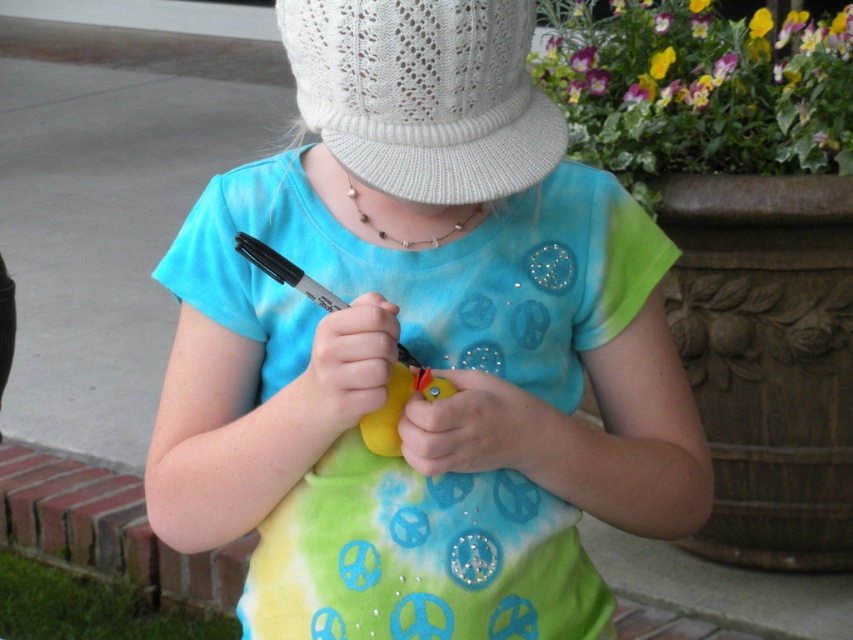
You are trying to place both the matte plastic rubber duck at center and the white knitted hat at center into a rectangular box. Which object might require a wider box?

The matte plastic rubber duck at center might require a wider box because it might be wider than the white knitted hat at center.

You are a photographer trying to capture a closeup of the matte plastic rubber duck at center and the white knitted hat at center. Since you want to focus on the duck, which object should you zoom in on more to ensure it appears bigger in the photo?

The matte plastic rubber duck at center is larger in size than the white knitted hat at center, so you should zoom in more on the matte plastic rubber duck at center to make it appear bigger in the photo.

You are a photographer trying to capture the matte plastic rubber duck at center. Your camera is set to a focal length of 50mm. According to the rule of thirds, where should you position the duck in the frame?

The rule of thirds involves dividing the frame into a 3x3 grid and placing the subject at the intersection points. Position the matte plastic rubber duck at center at one of these intersections for a balanced composition.